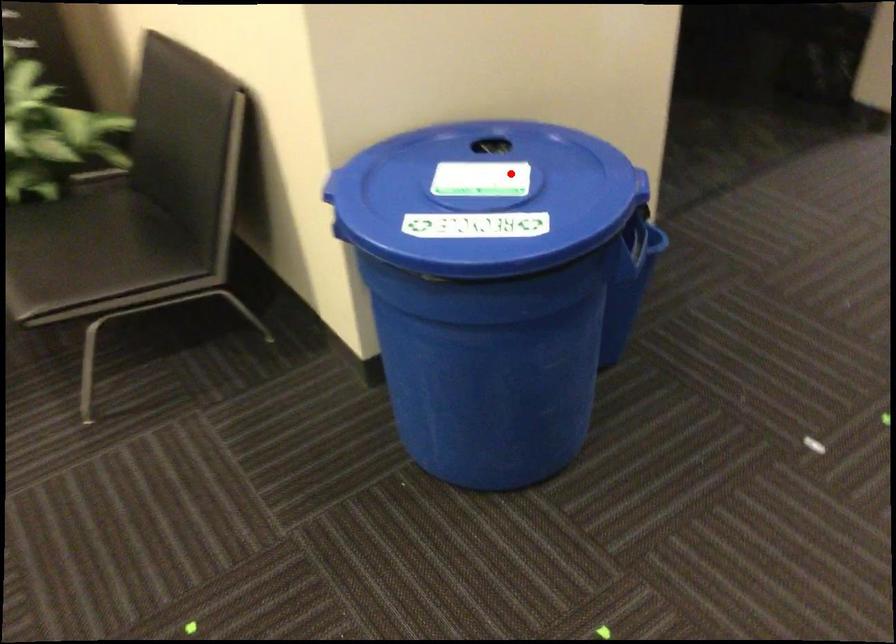
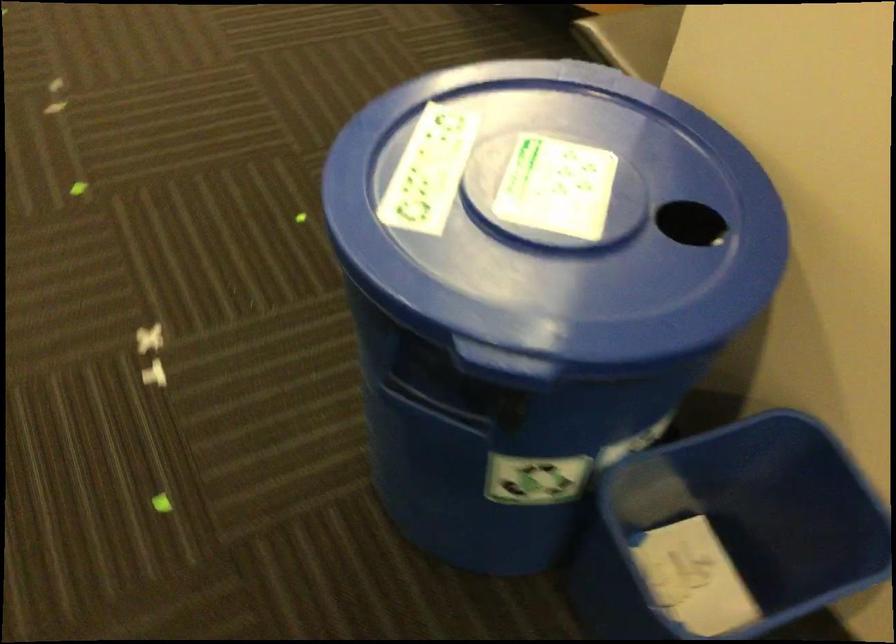
The point at the highlighted location is marked in the first image. Where is the corresponding point in the second image?

(561, 220)